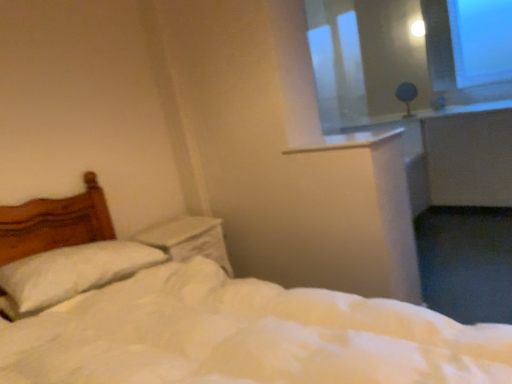
What do you see at coordinates (70, 273) in the screenshot?
I see `white soft pillow at left` at bounding box center [70, 273].

In the scene shown: What is the approximate width of matte gray table lamp at upper right?

matte gray table lamp at upper right is 5.25 inches in width.

In order to face matte gray table lamp at upper right, should I rotate leftwards or rightwards?

To face it directly, rotate right by 19.275 degrees.

Where is `white plastic window sill at upper center`? The height and width of the screenshot is (384, 512). white plastic window sill at upper center is located at coordinates (349, 140).

The image size is (512, 384). In order to click on white soft pillow at left in this screenshot , I will do pos(70,273).

Which is correct: matte gray table lamp at upper right is inside transparent plastic window screen at upper right, or outside of it?

The correct answer is: outside.

Based on their sizes in the image, would you say matte gray table lamp at upper right is bigger or smaller than transparent plastic window screen at upper right?

matte gray table lamp at upper right is smaller than transparent plastic window screen at upper right.

You are a GUI agent. You are given a task and a screenshot of the screen. Output one action in this format:
    pyautogui.click(x=<x>, y=<y>)
    Task: Click on the window screen on the left of matte gray table lamp at upper right
    The height and width of the screenshot is (384, 512).
    Given the screenshot: What is the action you would take?
    click(337, 62)

Which of these two, matte gray table lamp at upper right or transparent plastic window screen at upper right, stands taller?

transparent plastic window screen at upper right is taller.

Is white soft bed at center completely or partially inside white plastic window sill at upper center?

No, white soft bed at center is located outside of white plastic window sill at upper center.

Could you tell me if white plastic window sill at upper center is facing white soft bed at center?

No, white plastic window sill at upper center is not aimed at white soft bed at center.

Does white plastic window sill at upper center touch white soft bed at center?

No, white plastic window sill at upper center is not touching white soft bed at center.

Is white soft bed at center touching transparent plastic window screen at upper right?

No, white soft bed at center is not with transparent plastic window screen at upper right.

Which of these two, white soft bed at center or transparent plastic window screen at upper right, is wider?

With larger width is white soft bed at center.

From a real-world perspective, is white soft bed at center beneath transparent plastic window screen at upper right?

Indeed, from a real-world perspective, white soft bed at center is positioned beneath transparent plastic window screen at upper right.

Would you say white soft bed at center is inside or outside transparent plastic window screen at upper right?

white soft bed at center is spatially situated outside transparent plastic window screen at upper right.

From the image's perspective, is white plastic window sill at upper center beneath white soft pillow at left?

Actually, white plastic window sill at upper center appears above white soft pillow at left in the image.

Is point (387, 133) closer or farther from the camera than point (13, 300)?

Point (387, 133) is positioned farther from the camera compared to point (13, 300).

This screenshot has width=512, height=384. In the image, there is a white plastic window sill at upper center. In order to click on pillow below it (from a real-world perspective) in this screenshot , I will do `click(70, 273)`.

Considering the relative sizes of white plastic window sill at upper center and white soft pillow at left in the image provided, is white plastic window sill at upper center wider than white soft pillow at left?

Yes.

Are matte gray table lamp at upper right and white soft bed at center far apart?

matte gray table lamp at upper right is positioned a significant distance from white soft bed at center.

Does matte gray table lamp at upper right have a lesser height compared to white soft bed at center?

Correct, matte gray table lamp at upper right is not as tall as white soft bed at center.

Locate an element on the screen. This screenshot has width=512, height=384. table lamp that appears above the white soft bed at center (from a real-world perspective) is located at coordinates (406, 96).

Based on their sizes in the image, would you say matte gray table lamp at upper right is bigger or smaller than white soft bed at center?

Clearly, matte gray table lamp at upper right is smaller in size than white soft bed at center.

Locate an element on the screen. The width and height of the screenshot is (512, 384). window screen on the right of white soft pillow at left is located at coordinates (337, 62).

From a real-world perspective, is white soft pillow at left on transparent plastic window screen at upper right?

No, from a real-world perspective, white soft pillow at left is not on top of transparent plastic window screen at upper right.

Does point (41, 305) come behind point (358, 53)?

No.

Is white soft pillow at left not within transparent plastic window screen at upper right?

Absolutely, white soft pillow at left is external to transparent plastic window screen at upper right.

Considering the relative positions of white soft pillow at left and white plastic window sill at upper center in the image provided, is white soft pillow at left to the right of white plastic window sill at upper center from the viewer's perspective?

No.

Is white soft pillow at left in front of or behind white plastic window sill at upper center in the image?

In the image, white soft pillow at left appears in front of white plastic window sill at upper center.

Looking at the image, does white soft pillow at left seem bigger or smaller compared to white plastic window sill at upper center?

white soft pillow at left is bigger than white plastic window sill at upper center.

Is white soft pillow at left with white plastic window sill at upper center?

No.

Locate an element on the screen. The width and height of the screenshot is (512, 384). window screen below the matte gray table lamp at upper right (from the image's perspective) is located at coordinates (337, 62).

In order to click on bed on the left of white plastic window sill at upper center in this screenshot , I will do `click(204, 317)`.

When comparing their distances from white plastic window sill at upper center, does white soft bed at center or transparent plastic window screen at upper right seem closer?

Among the two, white soft bed at center is located nearer to white plastic window sill at upper center.

When comparing their distances from matte gray table lamp at upper right, does white soft bed at center or white soft pillow at left seem further?

Among the two, white soft bed at center is located further to matte gray table lamp at upper right.

When comparing their distances from white plastic window sill at upper center, does matte gray table lamp at upper right or white soft pillow at left seem further?

Among the two, matte gray table lamp at upper right is located further to white plastic window sill at upper center.

Looking at the image, which one is located closer to transparent plastic window screen at upper right, white plastic window sill at upper center or matte gray table lamp at upper right?

matte gray table lamp at upper right is closer to transparent plastic window screen at upper right.

Estimate the real-world distances between objects in this image. Which object is further from white plastic window sill at upper center, white soft pillow at left or matte gray table lamp at upper right?

matte gray table lamp at upper right.

Based on their spatial positions, is matte gray table lamp at upper right or white plastic window sill at upper center closer to white soft bed at center?

Based on the image, white plastic window sill at upper center appears to be nearer to white soft bed at center.

Consider the image. Looking at the image, which one is located further to white soft bed at center, transparent plastic window screen at upper right or white soft pillow at left?

Based on the image, transparent plastic window screen at upper right appears to be further to white soft bed at center.

Which object lies nearer to the anchor point matte gray table lamp at upper right, white plastic window sill at upper center or transparent plastic window screen at upper right?

transparent plastic window screen at upper right lies closer to matte gray table lamp at upper right than the other object.

This screenshot has width=512, height=384. Find the location of `pillow positioned between white soft bed at center and white plastic window sill at upper center from near to far`. pillow positioned between white soft bed at center and white plastic window sill at upper center from near to far is located at coordinates (70, 273).

Where is `window sill positioned between white soft bed at center and matte gray table lamp at upper right from near to far`? The width and height of the screenshot is (512, 384). window sill positioned between white soft bed at center and matte gray table lamp at upper right from near to far is located at coordinates (349, 140).

This screenshot has width=512, height=384. What are the coordinates of `pillow positioned between white soft bed at center and transparent plastic window screen at upper right from near to far` in the screenshot? It's located at (70, 273).

What are the coordinates of `window screen located between white soft pillow at left and matte gray table lamp at upper right in the left-right direction` in the screenshot? It's located at (337, 62).